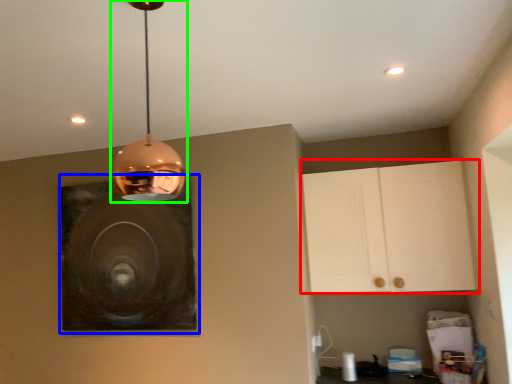
Question: Which is nearer to the cabinetry (highlighted by a red box)? picture frame (highlighted by a blue box) or lamp (highlighted by a green box).

Choices:
 (A) picture frame
 (B) lamp

Answer: (A)